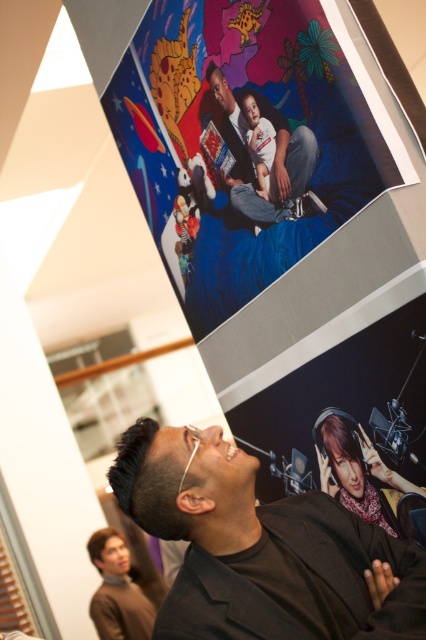
Between brown leather jacket at lower left and dark brown hair at lower left, which one appears on the left side from the viewer's perspective?

Positioned to the left is dark brown hair at lower left.

Who is shorter, brown leather jacket at lower left or dark brown hair at lower left?

Standing shorter between the two is dark brown hair at lower left.

Does point (123, 620) come behind point (100, 538)?

No, it is in front of (100, 538).

This screenshot has height=640, width=426. What are the coordinates of `brown leather jacket at lower left` in the screenshot? It's located at (118, 589).

What do you see at coordinates (261, 548) in the screenshot?
I see `black matte suit at lower center` at bounding box center [261, 548].

Which is more to the right, black matte suit at lower center or dark brown hair at lower left?

black matte suit at lower center

Measure the distance between point (x=339, y=538) and camera.

They are 4.17 feet apart.

Where is `black matte suit at lower center`? The height and width of the screenshot is (640, 426). black matte suit at lower center is located at coordinates (261, 548).

Looking at this image, does dark brown hair at upper center come in front of dark brown hair at lower left?

Yes.

Can you confirm if dark brown hair at upper center is taller than dark brown hair at lower left?

Correct, dark brown hair at upper center is much taller as dark brown hair at lower left.

Where is `dark brown hair at upper center`? This screenshot has width=426, height=640. dark brown hair at upper center is located at coordinates (149, 483).